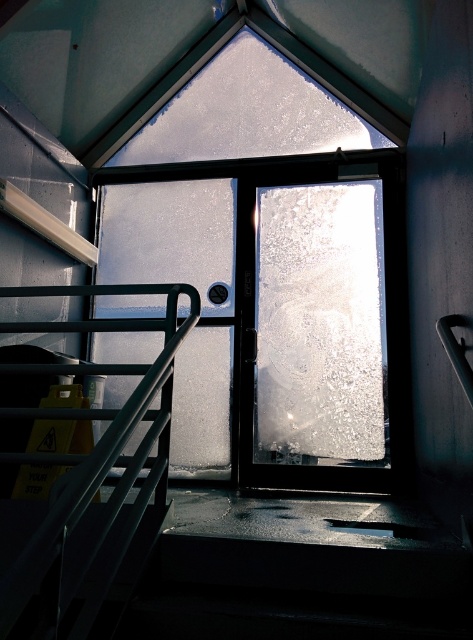
Can you confirm if frosted glass door at center is positioned to the right of frosted glass window at center?

No, frosted glass door at center is not to the right of frosted glass window at center.

Between point (336, 218) and point (322, 387), which one is positioned behind?

The point (336, 218) is more distant.

Who is more forward, [380,320] or [367,339]?

Positioned in front is point [367,339].

I want to click on frosted glass door at center, so click(282, 314).

Which is more to the left, frosted glass window at center or metallic black handrail at upper left?

From the viewer's perspective, metallic black handrail at upper left appears more on the left side.

Does point (294, 243) come farther from viewer compared to point (37, 544)?

Yes, it is behind point (37, 544).

Locate an element on the screen. The width and height of the screenshot is (473, 640). frosted glass window at center is located at coordinates (321, 324).

Who is positioned more to the left, frosted glass door at center or metallic black handrail at upper left?

Positioned to the left is metallic black handrail at upper left.

Who is taller, frosted glass door at center or metallic black handrail at upper left?

With more height is frosted glass door at center.

Which is behind, point (369, 221) or point (139, 410)?

Point (369, 221)

The width and height of the screenshot is (473, 640). In order to click on frosted glass door at center in this screenshot , I will do `click(282, 314)`.